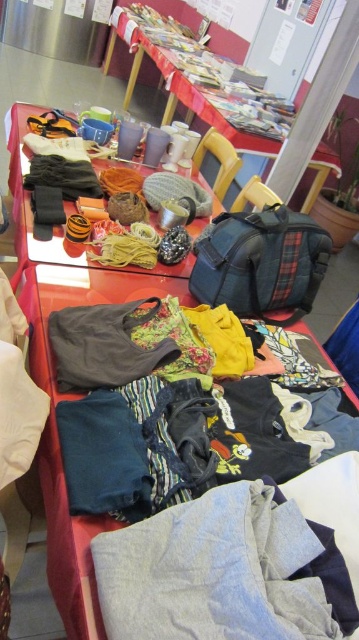
You are a person standing at the edge of the red table. You want to place a new item on the table. Which object, the fluffy fabric basket at center or the wooden chair at center, is closer to you so you can place the item there first?

The fluffy fabric basket at center is above the wooden chair at center, so the wooden chair at center is closer to you. You can place the item on the wooden chair at center first.

You are organizing items on the red table and need to place the fluffy fabric basket at center and the knitted woolen scarf at center. Which item requires more space on the table?

The fluffy fabric basket at center requires more space on the table because it is larger in size than the knitted woolen scarf at center.

You are organizing a charity event and need to place a new donation item between the gray cotton pants at lower center and the yellow fabric chair at center. Based on their current positions, where should you place the new item to ensure it is between them?

The new donation item should be placed to the right of the gray cotton pants at lower center and to the left of the yellow fabric chair at center, as the gray cotton pants at lower center is positioned on the left side of the yellow fabric chair at center.